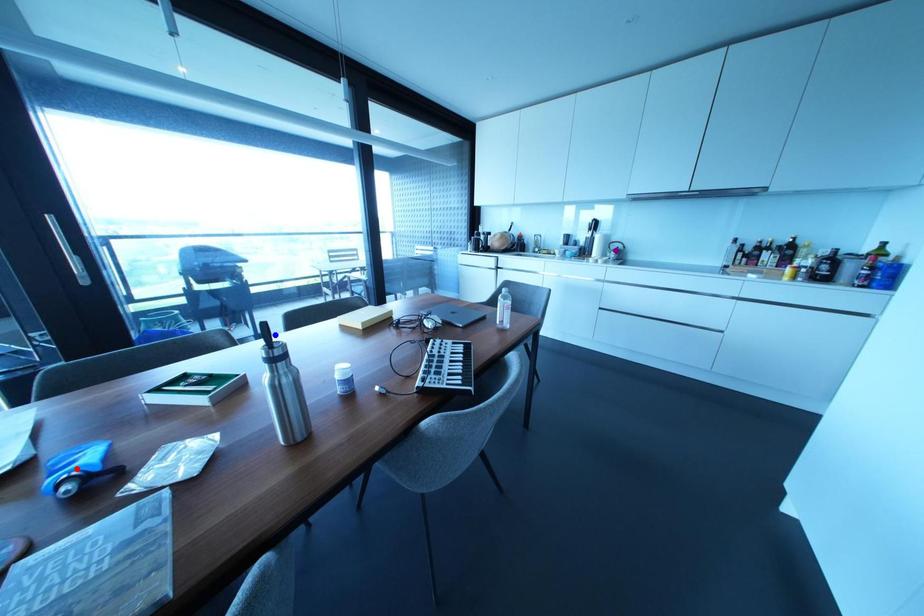
Order these from nearest to farthest:
blue point, purple point, red point

purple point
blue point
red point